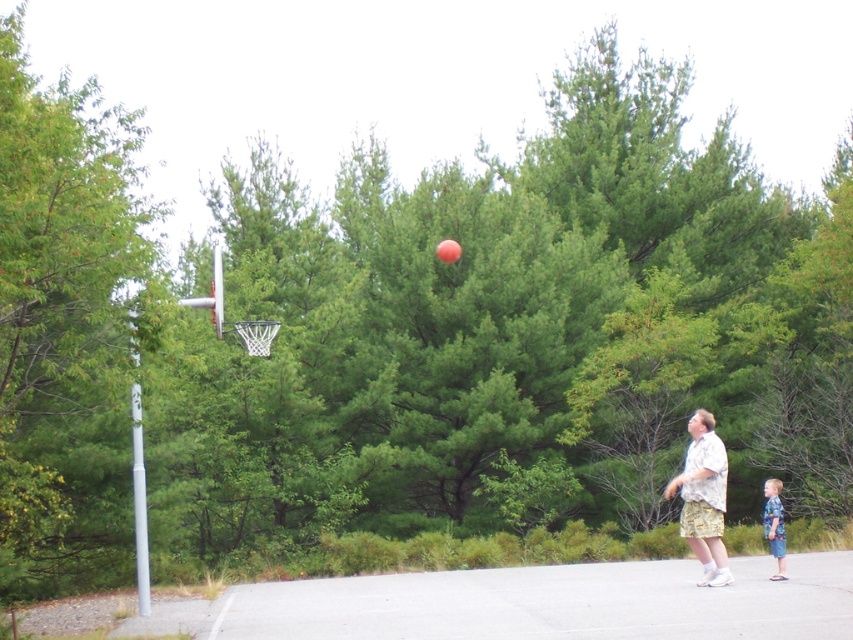
Question: Which of the following is the closest to the observer?

Choices:
 (A) (769, 490)
 (B) (721, 452)

Answer: (B)

Question: Does light brown textured shorts at lower right appear on the right side of blue plaid shirt at lower right?

Choices:
 (A) no
 (B) yes

Answer: (A)

Question: Is light brown textured shorts at lower right to the right of blue plaid shirt at lower right from the viewer's perspective?

Choices:
 (A) yes
 (B) no

Answer: (B)

Question: In this image, where is light brown textured shorts at lower right located relative to blue plaid shirt at lower right?

Choices:
 (A) left
 (B) right

Answer: (A)

Question: Which of the following is the farthest from the observer?

Choices:
 (A) light brown textured shorts at lower right
 (B) blue plaid shirt at lower right

Answer: (B)